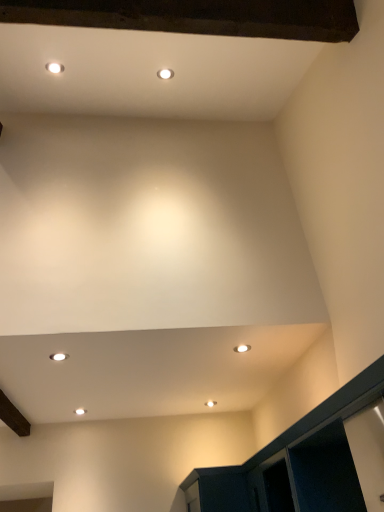
Looking at this image, in order to face white glossy light fixture at upper center, should I rotate leftwards or rightwards?

You should rotate right by 7.103 degrees.

Image resolution: width=384 pixels, height=512 pixels. What do you see at coordinates (242, 348) in the screenshot? I see `white glossy light fixture at upper center` at bounding box center [242, 348].

Measure the distance between white glossy light fixture at upper center and camera.

A distance of 7.90 feet exists between white glossy light fixture at upper center and camera.

Find the location of a particular element. This screenshot has height=512, width=384. white glossy light fixture at upper center is located at coordinates (242, 348).

Where is `white glossy light fixture at upper center`? white glossy light fixture at upper center is located at coordinates (242, 348).